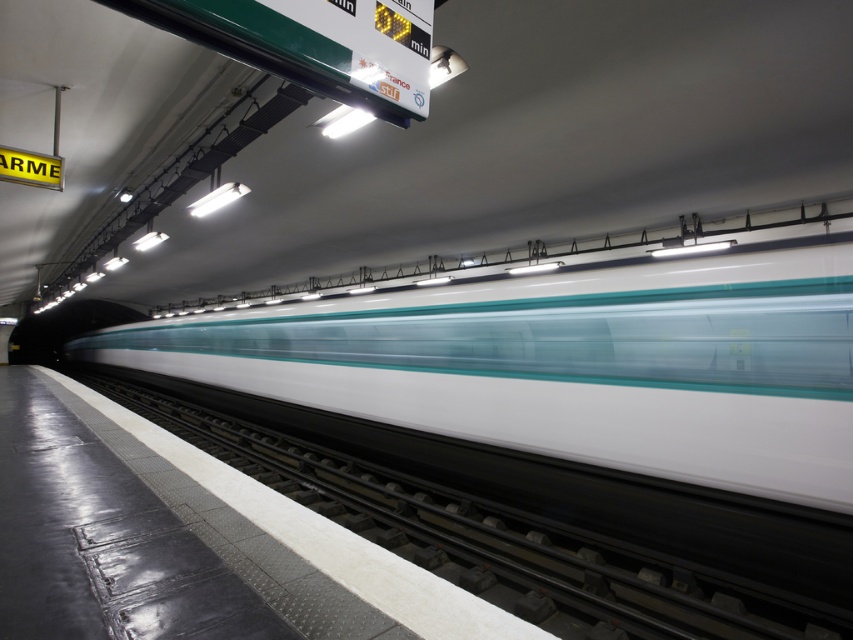
Based on the photo, you are standing on the subway platform and see a point marked at coordinates (567,365). According to the image, which object is this point located on?

The point at coordinates (567,365) is located on the white glossy train at center.

You are standing on the subway platform and notice the white glossy train at center. Based on its position, can you estimate how far it is from the tactile paving strip at the edge of the platform?

The white glossy train at center is located at point (567, 365), which means it is approximately 0.428 units away from the tactile paving strip at the edge of the platform.

You are a passenger waiting at the subway station and want to board the white glossy train at center. The train is moving very fast. Can you safely step onto the metallic gray train track at center to board the train?

The white glossy train at center is taller than the metallic gray train track at center. Since the train is moving very fast, stepping onto the track could be dangerous due to the height difference and speed, so it is not safe to do so.